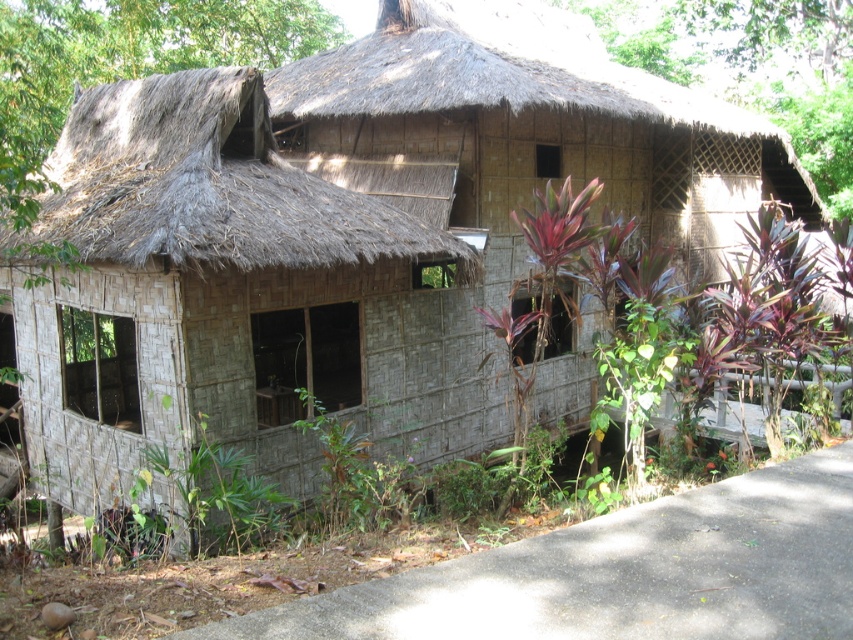
Question: Can you confirm if thatched straw roof at upper left is smaller than thatched straw roof at upper center?

Choices:
 (A) yes
 (B) no

Answer: (A)

Question: Which point appears closest to the camera in this image?

Choices:
 (A) (148, 237)
 (B) (318, 104)

Answer: (A)

Question: Is thatched straw roof at upper left wider than thatched straw roof at upper center?

Choices:
 (A) yes
 (B) no

Answer: (B)

Question: Does thatched straw roof at upper left come in front of thatched straw roof at upper center?

Choices:
 (A) no
 (B) yes

Answer: (B)